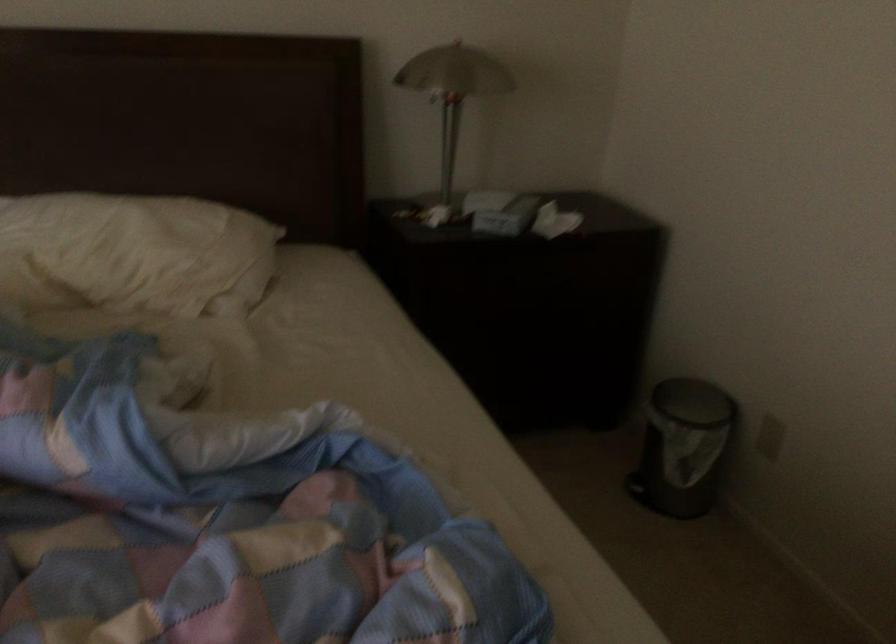
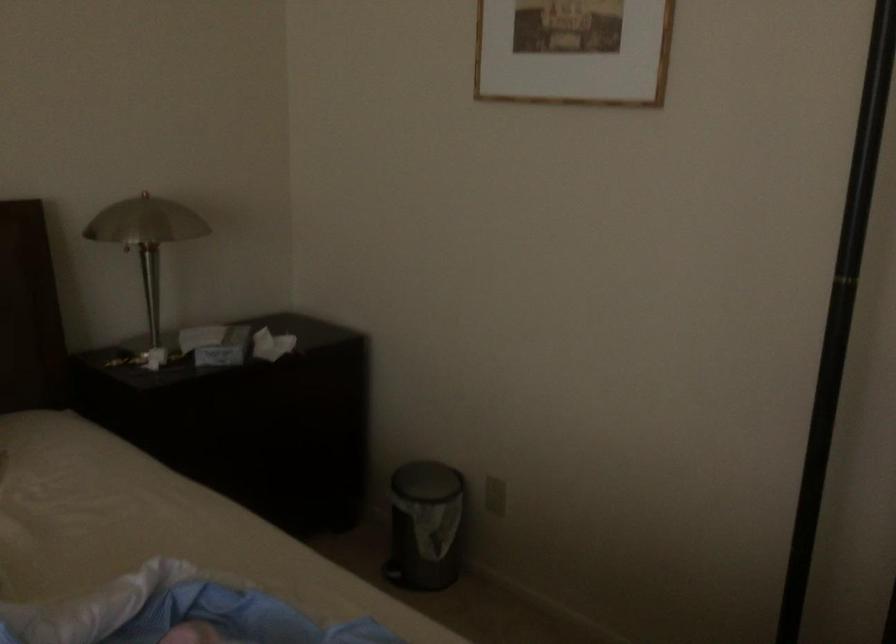
Locate, in the second image, the point that corresponds to pixel 494 211 in the first image.

(216, 344)